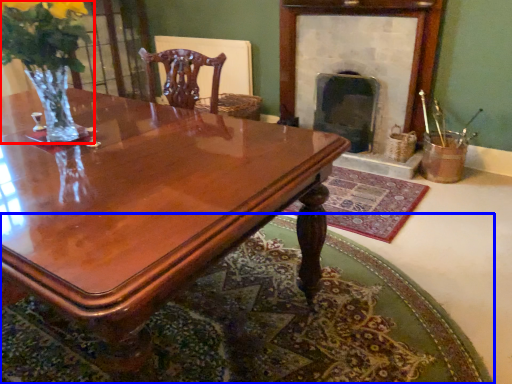
Question: Which object appears closest to the camera in this image, floral arrangement (highlighted by a red box) or mat (highlighted by a blue box)?

Choices:
 (A) floral arrangement
 (B) mat

Answer: (B)